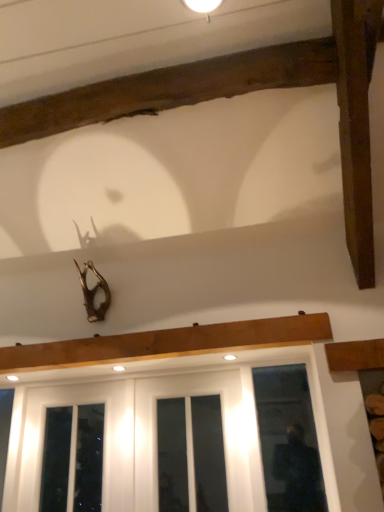
Question: Are white glossy wood at lower center, which is the 2th window in right-to-left order, and white matte light fixture at upper center located far from each other?

Choices:
 (A) no
 (B) yes

Answer: (B)

Question: From a real-world perspective, is white glossy wood at lower center, which is counted as the 1th window, starting from the left, located beneath white matte light fixture at upper center?

Choices:
 (A) no
 (B) yes

Answer: (B)

Question: Does white glossy wood at lower center, which is counted as the 1th window, starting from the left, have a greater height compared to white matte light fixture at upper center?

Choices:
 (A) yes
 (B) no

Answer: (A)

Question: Considering the relative sizes of white glossy wood at lower center, which is counted as the 1th window, starting from the left, and white matte light fixture at upper center in the image provided, is white glossy wood at lower center, which is counted as the 1th window, starting from the left, wider than white matte light fixture at upper center?

Choices:
 (A) no
 (B) yes

Answer: (A)

Question: Does white glossy wood at lower center, which is the 2th window in right-to-left order, appear on the right side of white matte light fixture at upper center?

Choices:
 (A) yes
 (B) no

Answer: (B)

Question: Considering the positions of clear glass door at lower right, which appears as the 2th window when viewed from the left, and white matte light fixture at upper center in the image, is clear glass door at lower right, which appears as the 2th window when viewed from the left, bigger or smaller than white matte light fixture at upper center?

Choices:
 (A) big
 (B) small

Answer: (A)

Question: In the image, is clear glass door at lower right, positioned as the 1th window in right-to-left order, on the left side or the right side of white matte light fixture at upper center?

Choices:
 (A) left
 (B) right

Answer: (B)

Question: Choose the correct answer: Is clear glass door at lower right, which appears as the 2th window when viewed from the left, inside white matte light fixture at upper center or outside it?

Choices:
 (A) outside
 (B) inside

Answer: (A)

Question: Looking at their shapes, would you say clear glass door at lower right, positioned as the 1th window in right-to-left order, is wider or thinner than white matte light fixture at upper center?

Choices:
 (A) wide
 (B) thin

Answer: (B)

Question: Looking at their shapes, would you say clear glass door at lower right, which appears as the 2th window when viewed from the left, is wider or thinner than white glossy screen door at lower center?

Choices:
 (A) thin
 (B) wide

Answer: (B)

Question: Considering the positions of point (291, 480) and point (153, 397), is point (291, 480) closer or farther from the camera than point (153, 397)?

Choices:
 (A) farther
 (B) closer

Answer: (B)

Question: Considering their positions, is clear glass door at lower right, which appears as the 2th window when viewed from the left, located in front of or behind white glossy screen door at lower center?

Choices:
 (A) behind
 (B) front

Answer: (B)

Question: From the image's perspective, is clear glass door at lower right, which appears as the 2th window when viewed from the left, above or below white glossy screen door at lower center?

Choices:
 (A) below
 (B) above

Answer: (B)

Question: Considering the positions of white glossy screen door at lower center and clear glass door at lower right, which appears as the 2th window when viewed from the left, in the image, is white glossy screen door at lower center bigger or smaller than clear glass door at lower right, which appears as the 2th window when viewed from the left,?

Choices:
 (A) big
 (B) small

Answer: (A)

Question: Would you say white glossy screen door at lower center is to the left or to the right of clear glass door at lower right, positioned as the 1th window in right-to-left order, in the picture?

Choices:
 (A) left
 (B) right

Answer: (A)